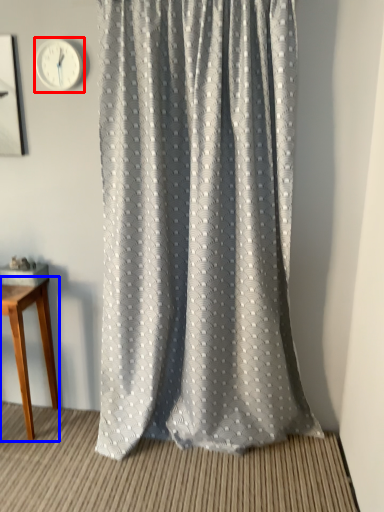
Question: Which object appears farthest to the camera in this image, clock (highlighted by a red box) or table (highlighted by a blue box)?

Choices:
 (A) clock
 (B) table

Answer: (B)